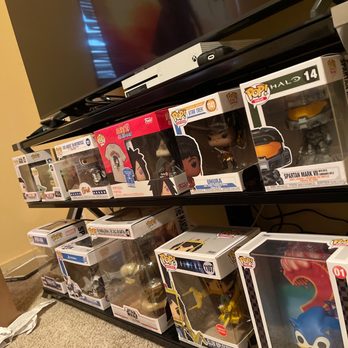
At what (x,y) coordinates should I click in order to perform the action: click on funko boxes. Please return your answer as a coordinate pair (x, y). Looking at the image, I should click on (293, 294), (199, 283), (136, 266), (66, 265), (45, 256), (297, 147), (209, 152), (146, 152), (66, 169), (44, 171).